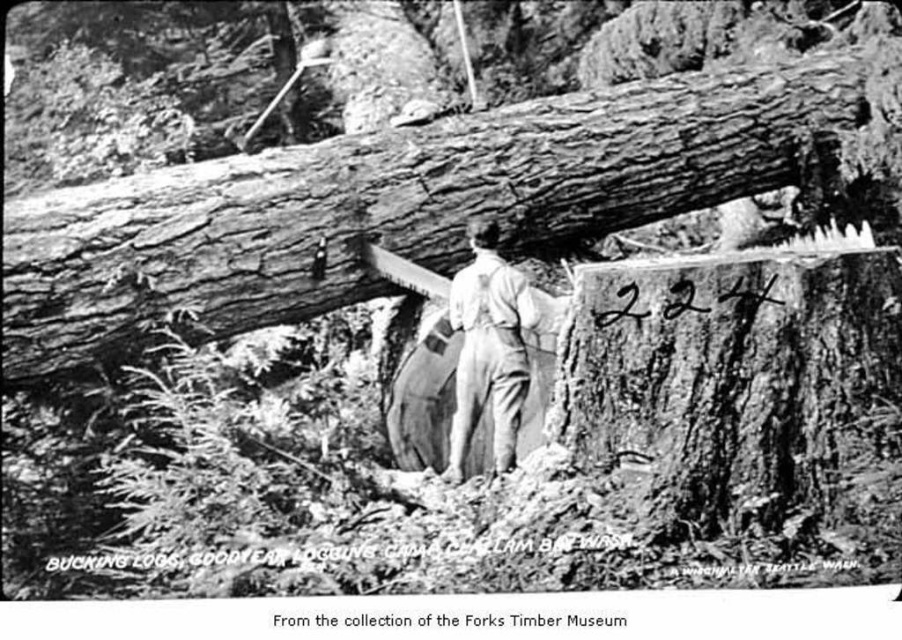
You are a photographer analyzing this historical image. You notice the rough bark log at center and the light gray overalls at center. Based on their positions, can you determine which object is closer to the camera?

The light gray overalls at center is behind the rough bark log at center, so the log is closer to the camera than the overalls.

Based on the scene described, where exactly is the rough bark log at center located in terms of coordinates?

The rough bark log at center is located at point coordinates of (394, 202).

You are a photographer trying to capture a closeup of the rough bark log at center and the light gray overalls at center in this historical logging scene. Since your camera can only focus on one object at a time, which object should you focus on to ensure it fills the frame more?

The rough bark log at center is wider than the light gray overalls at center, so focusing on the rough bark log at center will ensure it fills the frame more.